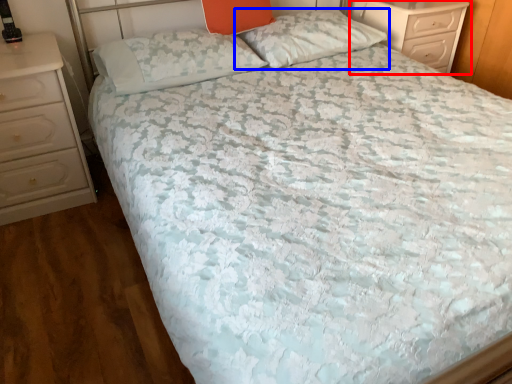
Question: Among these objects, which one is nearest to the camera, chest of drawers (highlighted by a red box) or pillow (highlighted by a blue box)?

Choices:
 (A) chest of drawers
 (B) pillow

Answer: (B)